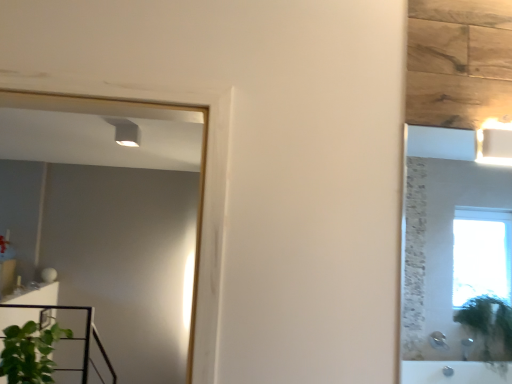
Image resolution: width=512 pixels, height=384 pixels. What do you see at coordinates (30, 353) in the screenshot? I see `green leafy plant at lower left` at bounding box center [30, 353].

This screenshot has width=512, height=384. I want to click on green leafy plant at lower left, so click(30, 353).

You are a GUI agent. You are given a task and a screenshot of the screen. Output one action in this format:
    pyautogui.click(x=<x>, y=<y>)
    Task: Click on the green leafy plant at lower left
    Image resolution: width=512 pixels, height=384 pixels.
    Given the screenshot: What is the action you would take?
    pyautogui.click(x=30, y=353)